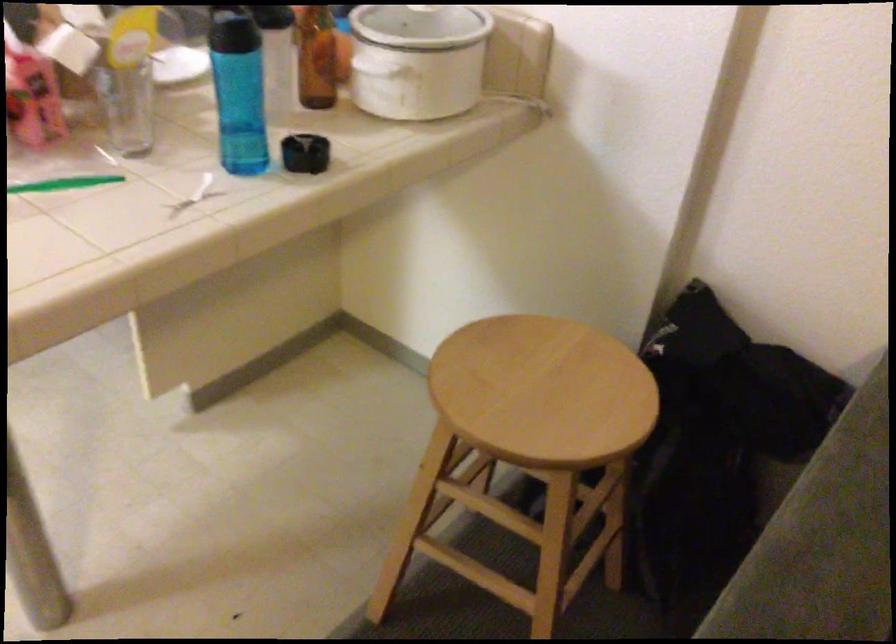
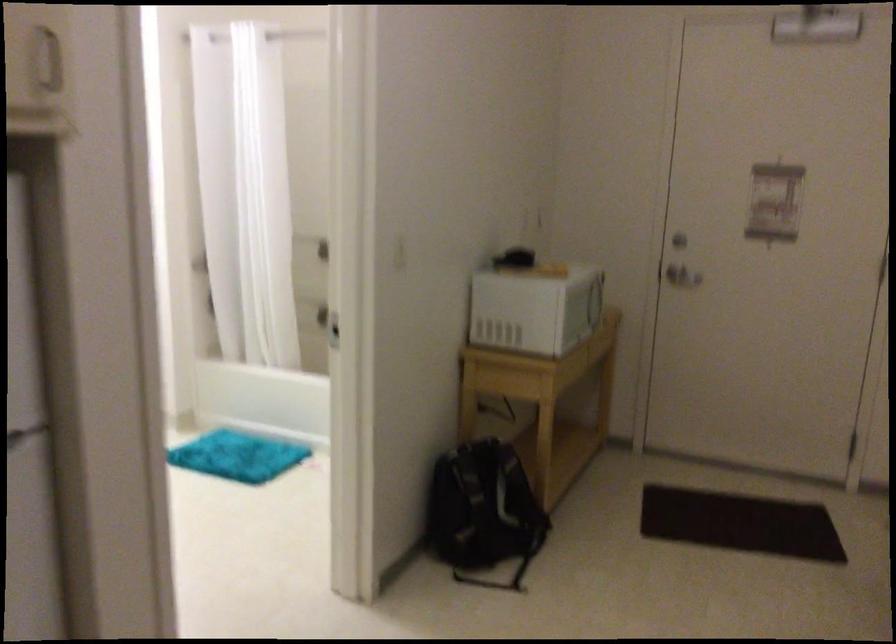
Question: The camera is either moving clockwise (left) or counter-clockwise (right) around the object. The first image is from the beginning of the video and the second image is from the end. Is the camera moving left or right when shooting the video?

Choices:
 (A) Left
 (B) Right

Answer: (B)